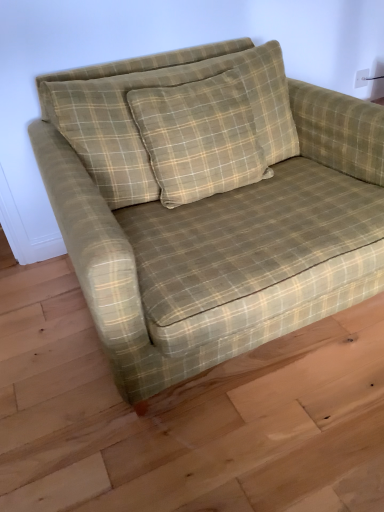
Question: From their relative heights in the image, would you say green plaid fabric couch at center is taller or shorter than green plaid pillow at center?

Choices:
 (A) tall
 (B) short

Answer: (A)

Question: Is point (382, 231) positioned closer to the camera than point (61, 102)?

Choices:
 (A) farther
 (B) closer

Answer: (B)

Question: Which object is the farthest from the white plastic electric outlet at upper right?

Choices:
 (A) green plaid fabric couch at center
 (B) green plaid pillow at center

Answer: (A)

Question: Based on their relative distances, which object is nearer to the green plaid pillow at center?

Choices:
 (A) white plastic electric outlet at upper right
 (B) green plaid fabric couch at center

Answer: (B)